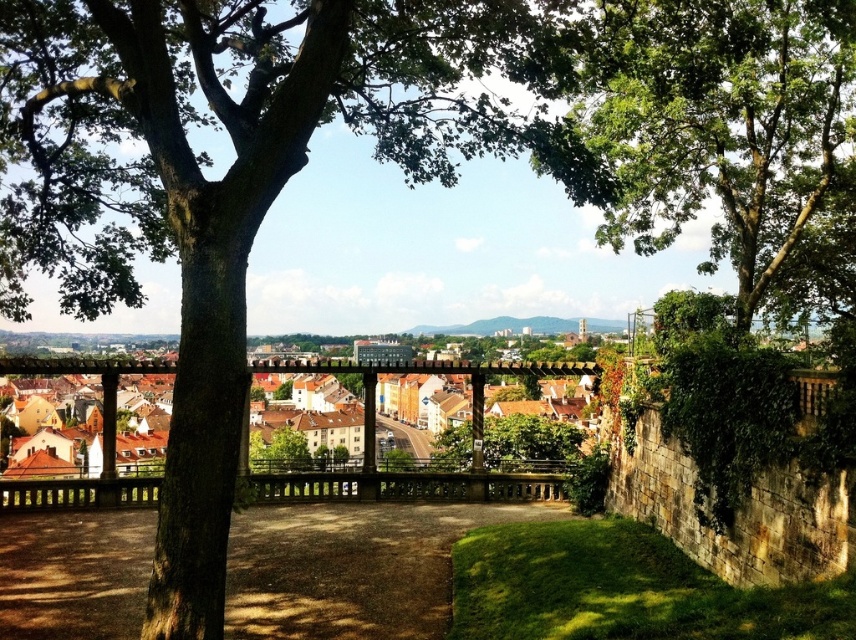
Question: Where is green rough bark tree at center located in relation to green leafy tree at upper right in the image?

Choices:
 (A) left
 (B) right

Answer: (A)

Question: Which of the following is the farthest from the observer?

Choices:
 (A) (201, 200)
 (B) (530, 420)
 (C) (605, 148)
 (D) (700, 305)

Answer: (B)

Question: Does green leafy tree at upper center appear under green leafy tree at upper right?

Choices:
 (A) no
 (B) yes

Answer: (A)

Question: Which of the following is the farthest from the observer?

Choices:
 (A) (18, 264)
 (B) (504, 454)

Answer: (B)

Question: Can you confirm if green rough bark tree at center is positioned below green leafy tree at upper center?

Choices:
 (A) yes
 (B) no

Answer: (B)

Question: Which is nearer to the green rough bark tree at center?

Choices:
 (A) green leafy tree at upper center
 (B) green leafy tree at upper right

Answer: (A)